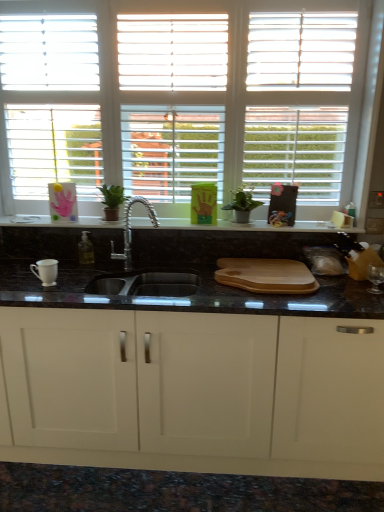
Measure the distance between point [107,227] and camera.

Point [107,227] and camera are 7.53 feet apart.

In order to face black granite cutting board at center, should I rotate leftwards or rightwards?

To face it directly, rotate left by 1.340 degrees.

Where is `white matte window at upper center`? The image size is (384, 512). white matte window at upper center is located at coordinates (182, 99).

Where is `wooden cutting board at center`? Image resolution: width=384 pixels, height=512 pixels. wooden cutting board at center is located at coordinates (266, 275).

Based on their sizes in the image, would you say white matte cabinet at center is bigger or smaller than wooden cutting board at center?

Clearly, white matte cabinet at center is larger in size than wooden cutting board at center.

Considering the relative positions of white matte cabinet at center and wooden cutting board at center in the image provided, is white matte cabinet at center to the left or to the right of wooden cutting board at center?

From the image, it's evident that white matte cabinet at center is to the left of wooden cutting board at center.

Between white matte cabinet at center and wooden cutting board at center, which one has smaller width?

Thinner between the two is wooden cutting board at center.

Does wooden cutting board at center have a greater width compared to black granite cutting board at center?

Correct, the width of wooden cutting board at center exceeds that of black granite cutting board at center.

Which object is more forward, wooden cutting board at center or black granite cutting board at center?

wooden cutting board at center.

Is wooden cutting board at center touching black granite cutting board at center?

wooden cutting board at center is not next to black granite cutting board at center, and they're not touching.

Which is correct: wooden cutting board at center is inside black granite cutting board at center, or outside of it?

wooden cutting board at center lies outside black granite cutting board at center.

Which object is wider, white matte window at upper center or wooden cutting board at center?

Wider between the two is wooden cutting board at center.

How distant is white matte window at upper center from wooden cutting board at center?

The distance of white matte window at upper center from wooden cutting board at center is 33.22 inches.

Is white matte window at upper center facing towards wooden cutting board at center?

No, white matte window at upper center is not oriented towards wooden cutting board at center.

In the scene shown: Is white matte window at upper center facing away from white matte cabinet at center?

No, white matte cabinet at center is not at the back of white matte window at upper center.

How different are the orientations of white matte window at upper center and white matte cabinet at center in degrees?

0.721 degrees.

From the picture: Which of these two, white matte window at upper center or white matte cabinet at center, is thinner?

Thinner between the two is white matte window at upper center.

Can you confirm if white matte window at upper center is smaller than white matte cabinet at center?

Yes, white matte window at upper center is smaller than white matte cabinet at center.

Based on the photo, considering the positions of objects black granite cutting board at center and wooden cutting board at center in the image provided, who is more to the left, black granite cutting board at center or wooden cutting board at center?

black granite cutting board at center is more to the left.

Can you confirm if black granite cutting board at center is bigger than wooden cutting board at center?

Actually, black granite cutting board at center might be smaller than wooden cutting board at center.

Could you tell me if black granite cutting board at center is turned towards wooden cutting board at center?

No, black granite cutting board at center is not oriented towards wooden cutting board at center.

Which object is more forward, black granite cutting board at center or wooden cutting board at center?

Positioned in front is wooden cutting board at center.

Which is behind, point (261, 229) or point (171, 446)?

The point (261, 229) is farther.

Based on the photo, can you tell me how much black granite cutting board at center and white matte cabinet at center differ in facing direction?

0.911 degrees separate the facing orientations of black granite cutting board at center and white matte cabinet at center.

From the image's perspective, relative to white matte cabinet at center, is black granite cutting board at center above or below?

black granite cutting board at center is above white matte cabinet at center.

From a real-world perspective, which is physically below, black granite cutting board at center or white matte cabinet at center?

In real-world perspective, white matte cabinet at center is lower.

Between white matte window at upper center and green matte plant at center, which one is positioned in front?

white matte window at upper center is in front.

In terms of height, does white matte window at upper center look taller or shorter compared to green matte plant at center?

Clearly, white matte window at upper center is taller compared to green matte plant at center.

You are a GUI agent. You are given a task and a screenshot of the screen. Output one action in this format:
    pyautogui.click(x=<x>, y=<y>)
    Task: Click on the window in front of the green matte plant at center
    
    Given the screenshot: What is the action you would take?
    pyautogui.click(x=182, y=99)

Is white matte window at upper center positioned far away from green matte plant at center?

white matte window at upper center is actually quite close to green matte plant at center.

You are a GUI agent. You are given a task and a screenshot of the screen. Output one action in this format:
    pyautogui.click(x=<x>, y=<y>)
    Task: Click on the tray on the right side of white matte cabinet at center
    The height and width of the screenshot is (512, 384).
    Given the screenshot: What is the action you would take?
    pyautogui.click(x=266, y=275)

At what (x,y) coordinates should I click in order to perform the action: click on tray below the black granite cutting board at center (from a real-world perspective). Please return your answer as a coordinate pair (x, y). The height and width of the screenshot is (512, 384). Looking at the image, I should click on (266, 275).

When comparing their distances from wooden cutting board at center, does green matte plant at center or white matte window at upper center seem closer?

Based on the image, green matte plant at center appears to be nearer to wooden cutting board at center.

Which object lies nearer to the anchor point wooden cutting board at center, polished chrome faucet at center or white matte cabinet at center?

white matte cabinet at center lies closer to wooden cutting board at center than the other object.

Which object lies further to the anchor point wooden cutting board at center, black granite cutting board at center or polished chrome faucet at center?

polished chrome faucet at center is further to wooden cutting board at center.

Considering their positions, is wooden cutting board at center positioned further to black granite cutting board at center than green matte plant at center?

The object further to black granite cutting board at center is wooden cutting board at center.

Looking at the image, which one is located closer to green matte plant at center, white matte window at upper center or polished chrome faucet at center?

Based on the image, polished chrome faucet at center appears to be nearer to green matte plant at center.

When comparing their distances from black granite cutting board at center, does green matte plant at center or wooden cutting board at center seem further?

The object further to black granite cutting board at center is wooden cutting board at center.

In the scene shown: Estimate the real-world distances between objects in this image. Which object is further from white matte cabinet at center, wooden cutting board at center or black granite cutting board at center?

black granite cutting board at center is positioned further to the anchor white matte cabinet at center.

From the image, which object appears to be nearer to green matte plant at center, white matte window at upper center or wooden cutting board at center?

Based on the image, wooden cutting board at center appears to be nearer to green matte plant at center.

Where is `tray between green matte plant at center and white matte cabinet at center in the vertical direction`? Image resolution: width=384 pixels, height=512 pixels. tray between green matte plant at center and white matte cabinet at center in the vertical direction is located at coordinates (266, 275).

Locate an element on the screen. This screenshot has height=512, width=384. tap between white matte window at upper center and white matte cabinet at center vertically is located at coordinates coord(130,230).

The image size is (384, 512). What are the coordinates of `tray between white matte window at upper center and white matte cabinet at center vertically` in the screenshot? It's located at (266, 275).

The image size is (384, 512). In order to click on counter top between white matte window at upper center and white matte cabinet at center from top to bottom in this screenshot , I will do `click(256, 226)`.